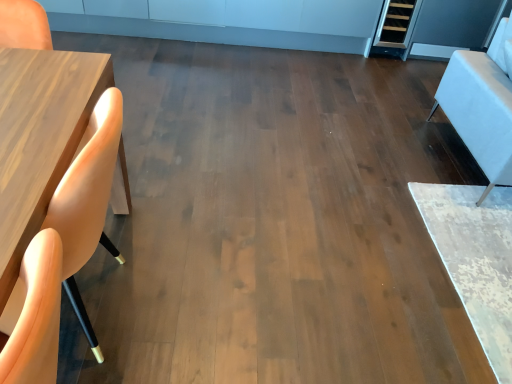
Where is `vacant area on the back side of matte wood chair at left`? vacant area on the back side of matte wood chair at left is located at coordinates (169, 175).